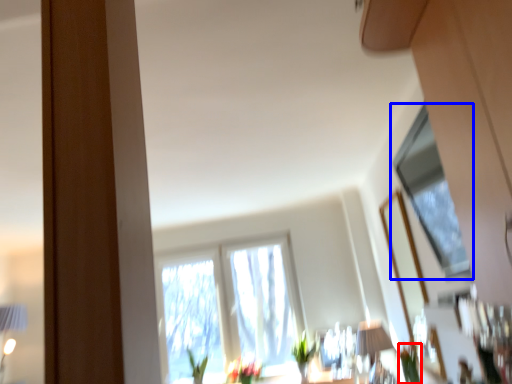
Question: Among these objects, which one is nearest to the camera, plant (highlighted by a red box) or window (highlighted by a blue box)?

Choices:
 (A) plant
 (B) window

Answer: (B)